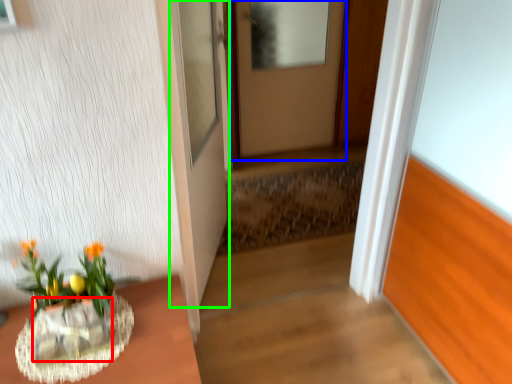
Question: Based on their relative distances, which object is nearer to glass vase (highlighted by a red box)? Choose from door (highlighted by a blue box) and door (highlighted by a green box).

Choices:
 (A) door
 (B) door

Answer: (B)